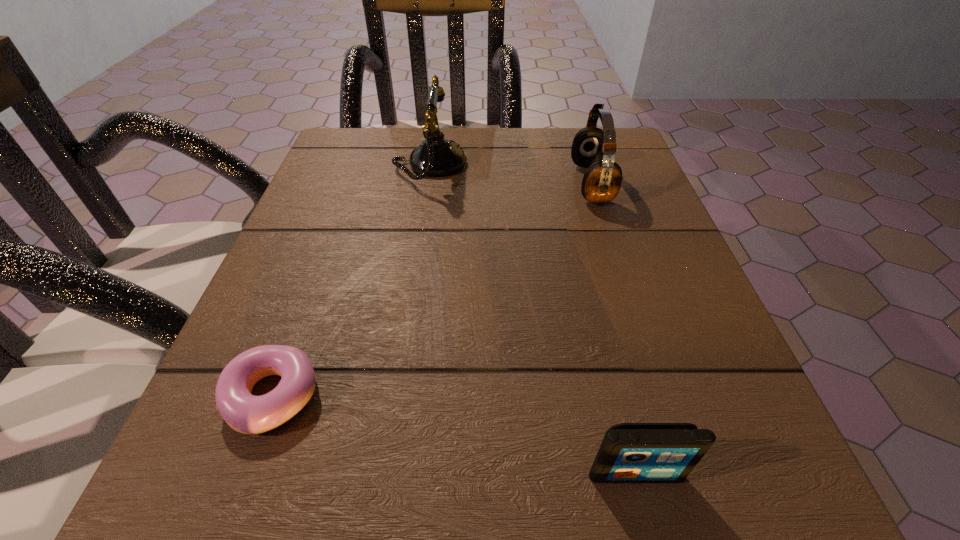
You are a GUI agent. You are given a task and a screenshot of the screen. Output one action in this format:
    pyautogui.click(x=<x>, y=<y>)
    Task: Click on the third object from right to left
    The height and width of the screenshot is (540, 960).
    Given the screenshot: What is the action you would take?
    (x=436, y=156)

Find the location of a particular element. Image resolution: width=960 pixels, height=540 pixels. headset is located at coordinates (592, 148).

You are a GUI agent. You are given a task and a screenshot of the screen. Output one action in this format:
    pyautogui.click(x=<x>, y=<y>)
    Task: Click on the iPod
    
    Given the screenshot: What is the action you would take?
    pyautogui.click(x=630, y=452)

Identify the location of the nearest object. The image size is (960, 540). (630, 452).

Identify the location of the leftmost object. This screenshot has height=540, width=960. (245, 413).

Find the location of `doughnut`. doughnut is located at coordinates (245, 413).

The image size is (960, 540). In order to click on free space located 0.310m on the dial of the third object from right to left in this screenshot , I will do click(x=612, y=165).

Find the location of a particular element. vacant space located 0.090m on the ear cups of the headset is located at coordinates (528, 184).

The width and height of the screenshot is (960, 540). I want to click on vacant region located 0.160m on the ear cups of the headset, so click(x=492, y=184).

This screenshot has height=540, width=960. I want to click on vacant space located on the ear cups of the headset, so point(407,184).